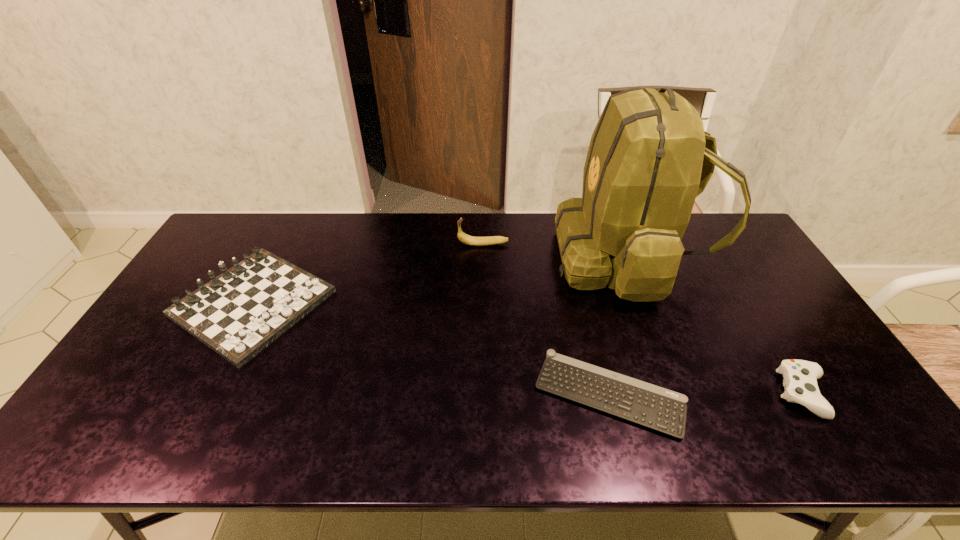
I want to click on object that is the third closest to the second tallest object, so click(651, 406).

Where is `vacant space that satisfies the following two spatial constraints: 1. on the back side of the control; 2. on the front-facing side of the tallest object`? vacant space that satisfies the following two spatial constraints: 1. on the back side of the control; 2. on the front-facing side of the tallest object is located at coordinates (720, 257).

At what (x,y) coordinates should I click in order to perform the action: click on vacant region that satisfies the following two spatial constraints: 1. at the stem of the second tallest object; 2. on the left side of the fourth tallest object. Please return your answer as a coordinate pair (x, y). Image resolution: width=960 pixels, height=540 pixels. Looking at the image, I should click on (485, 394).

The width and height of the screenshot is (960, 540). In order to click on free space that satisfies the following two spatial constraints: 1. at the stem of the banana; 2. on the back side of the shortest object in this screenshot , I will do `click(485, 394)`.

This screenshot has height=540, width=960. What are the coordinates of `free point that satisfies the following two spatial constraints: 1. at the stem of the banana; 2. on the back side of the control` in the screenshot? It's located at (485, 394).

Locate an element on the screen. This screenshot has width=960, height=540. vacant position in the image that satisfies the following two spatial constraints: 1. on the front side of the third tallest object; 2. on the right side of the control is located at coordinates (206, 394).

I want to click on blank space that satisfies the following two spatial constraints: 1. on the front-facing side of the control; 2. on the right side of the backpack, so pyautogui.click(x=680, y=394).

You are a GUI agent. You are given a task and a screenshot of the screen. Output one action in this format:
    pyautogui.click(x=<x>, y=<y>)
    Task: Click on the free spot that satisfies the following two spatial constraints: 1. at the stem of the banana; 2. on the left side of the computer keyboard
    
    Given the screenshot: What is the action you would take?
    pyautogui.click(x=485, y=394)